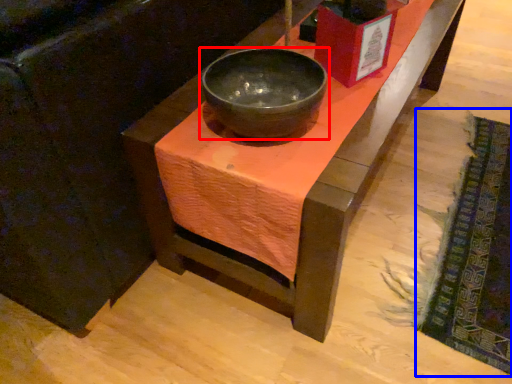
Question: Which object appears closest to the camera in this image, bowl (highlighted by a red box) or mat (highlighted by a blue box)?

Choices:
 (A) bowl
 (B) mat

Answer: (A)